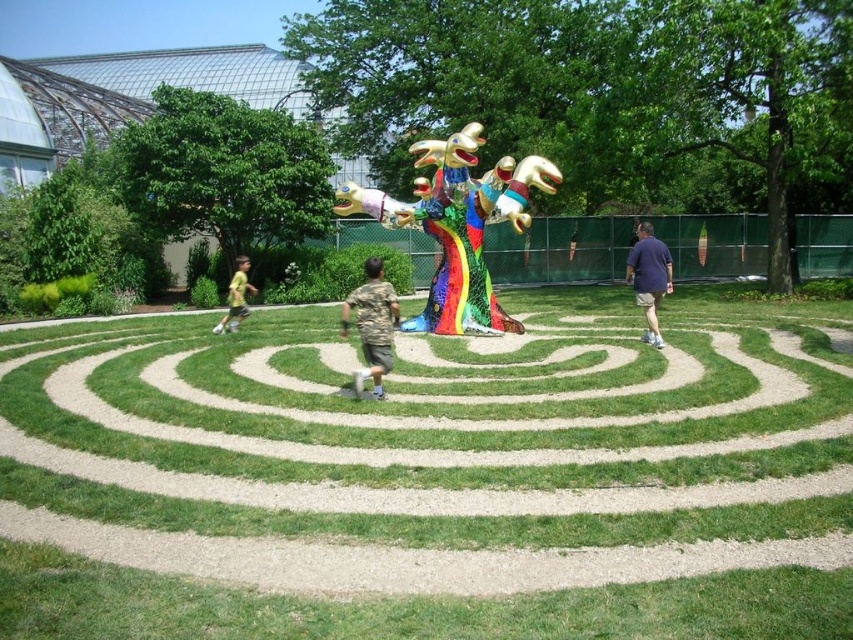
You are planning to take a group photo of the dark blue shirt at right and the yellow cotton shirt at left. Which person should stand on the left side of the photo to ensure proper framing?

The dark blue shirt at right should stand on the left side of the photo because it is wider than the yellow cotton shirt at left, allowing for better balance in the composition.

You are standing at the center of the labyrinth paths and want to find the camouflage fabric shirt at center. According to the coordinates provided, in which direction should you move to locate it?

The camouflage fabric shirt at center is located at coordinates point (372, 324). Since you are at the center of the labyrinth paths, which is likely the origin point, you should move towards the direction of the coordinates to find it.

You are a photographer standing in the center of the labyrinth paths. You want to take a photo that includes both the camouflage fabric shirt at center and the dark blue shirt at right. Which direction should you position yourself to ensure both are visible in the frame?

The camouflage fabric shirt at center is located below the dark blue shirt at right, so positioning yourself above the camouflage fabric shirt at center and facing towards it would allow both to be visible in the frame.